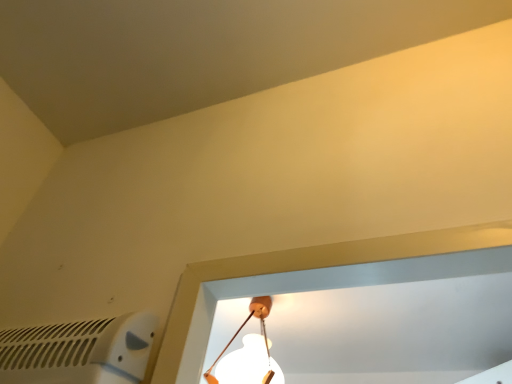
Question: Relative to white matte lamp at center, is white plastic air conditioning at lower left in front or behind?

Choices:
 (A) behind
 (B) front

Answer: (B)

Question: Considering the positions of white plastic air conditioning at lower left and white matte lamp at center in the image, is white plastic air conditioning at lower left bigger or smaller than white matte lamp at center?

Choices:
 (A) big
 (B) small

Answer: (B)

Question: Which is correct: white plastic air conditioning at lower left is inside white matte lamp at center, or outside of it?

Choices:
 (A) inside
 (B) outside

Answer: (B)

Question: In terms of width, does white matte lamp at center look wider or thinner when compared to white plastic air conditioning at lower left?

Choices:
 (A) thin
 (B) wide

Answer: (B)

Question: From their relative heights in the image, would you say white matte lamp at center is taller or shorter than white plastic air conditioning at lower left?

Choices:
 (A) short
 (B) tall

Answer: (B)

Question: Which is correct: white matte lamp at center is inside white plastic air conditioning at lower left, or outside of it?

Choices:
 (A) outside
 (B) inside

Answer: (A)

Question: From the image's perspective, is white matte lamp at center positioned above or below white plastic air conditioning at lower left?

Choices:
 (A) below
 (B) above

Answer: (A)